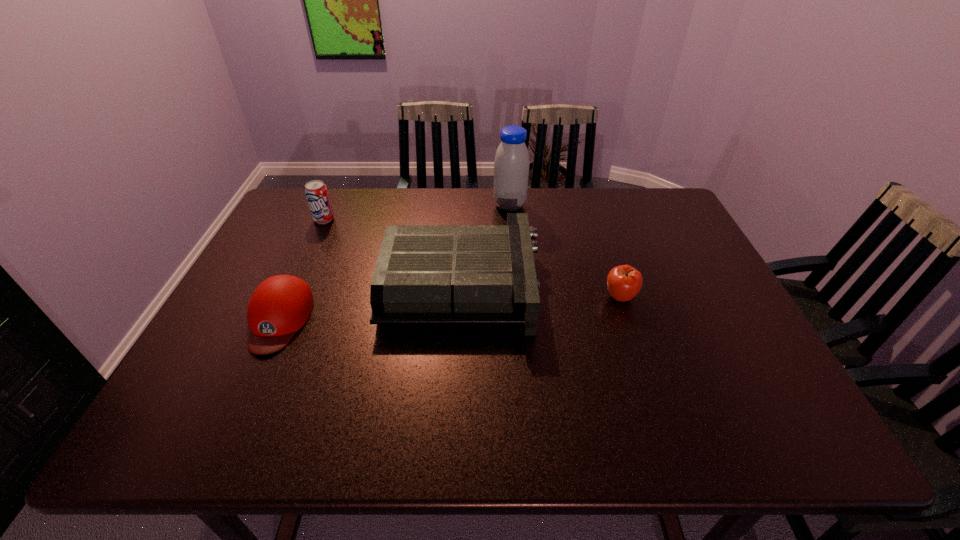
Where is `blank area in the image that satisfies the following two spatial constraints: 1. on the front panel of the radio receiver; 2. on the front-facing side of the baseball cap`? Image resolution: width=960 pixels, height=540 pixels. blank area in the image that satisfies the following two spatial constraints: 1. on the front panel of the radio receiver; 2. on the front-facing side of the baseball cap is located at coordinates (460, 320).